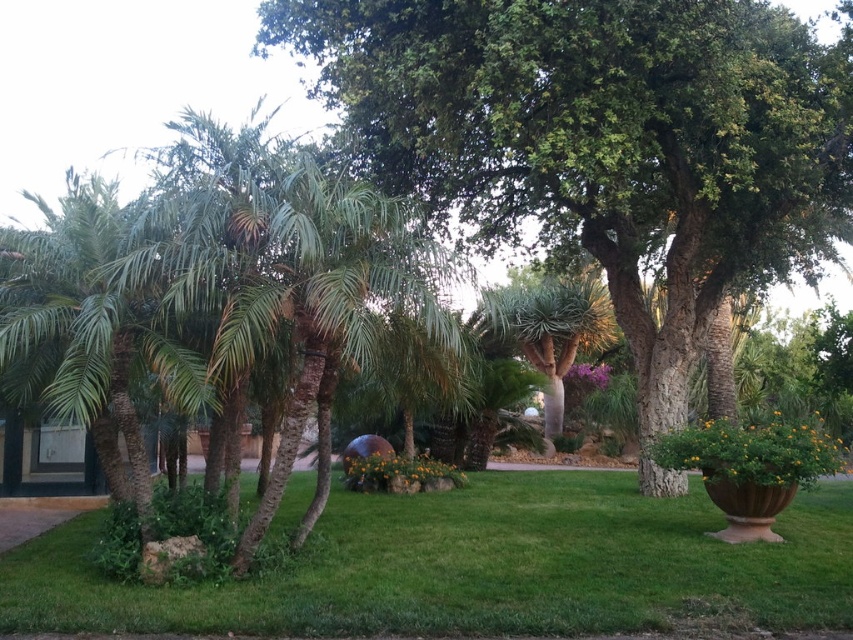
Question: Does green leafy tree at center appear on the left side of green leafy palm tree at center?

Choices:
 (A) yes
 (B) no

Answer: (B)

Question: Which object appears closest to the camera in this image?

Choices:
 (A) green leafy tree at center
 (B) green leafy palm tree at left
 (C) green leafy palm tree at center

Answer: (C)

Question: Can you confirm if green leafy tree at center is positioned below green leafy palm tree at center?

Choices:
 (A) no
 (B) yes

Answer: (A)

Question: Estimate the real-world distances between objects in this image. Which object is closer to the green leafy palm tree at center?

Choices:
 (A) green leafy palm tree at left
 (B) green leafy tree at center
 (C) green grass at center

Answer: (B)

Question: Which point is closer to the camera taking this photo?

Choices:
 (A) (544, 125)
 (B) (335, 589)

Answer: (B)

Question: Does green leafy palm tree at left have a larger size compared to green leafy palm tree at center?

Choices:
 (A) yes
 (B) no

Answer: (B)